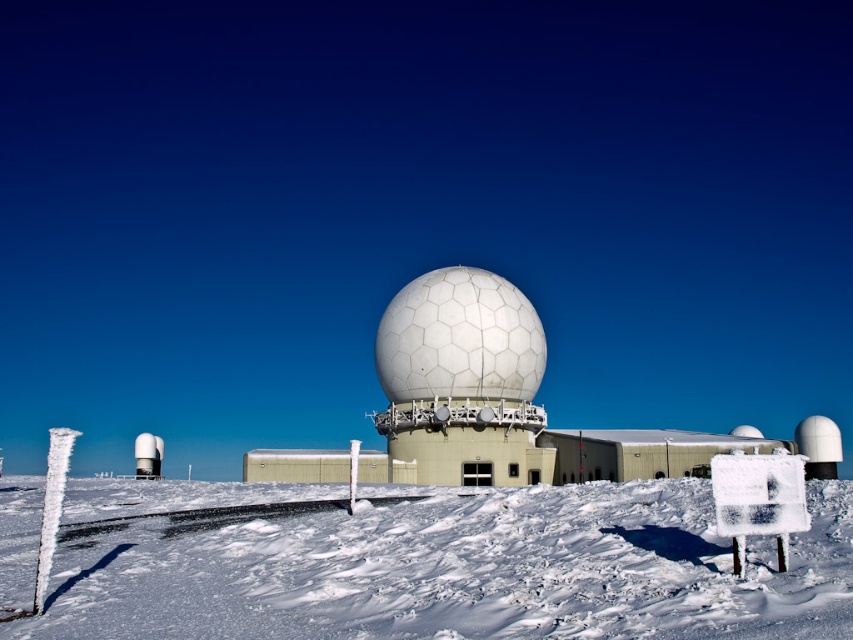
You are standing in the snowy landscape and want to walk towards the white hexagonal dome at center. Which direction should you move relative to the white powdery snow at lower center?

You should move away from the white powdery snow at lower center because the white hexagonal dome at center is further away from the viewer than the snow.

You are standing at the rectangular building with a flat roof and want to walk to the nearest point. Which point should you go to first, point (457, 513) or point (486, 385)?

Point (457, 513) is in front of point (486, 385), so you should go to point (457, 513) first because it is closer to you.

You are a maintenance worker needing to access the white hexagonal dome at center from the white powdery snow at lower center. Considering the elevation difference, will you need to climb upwards or go downwards?

The white powdery snow at lower center has a lesser height compared to white hexagonal dome at center, so you will need to climb upwards to reach the white hexagonal dome at center.